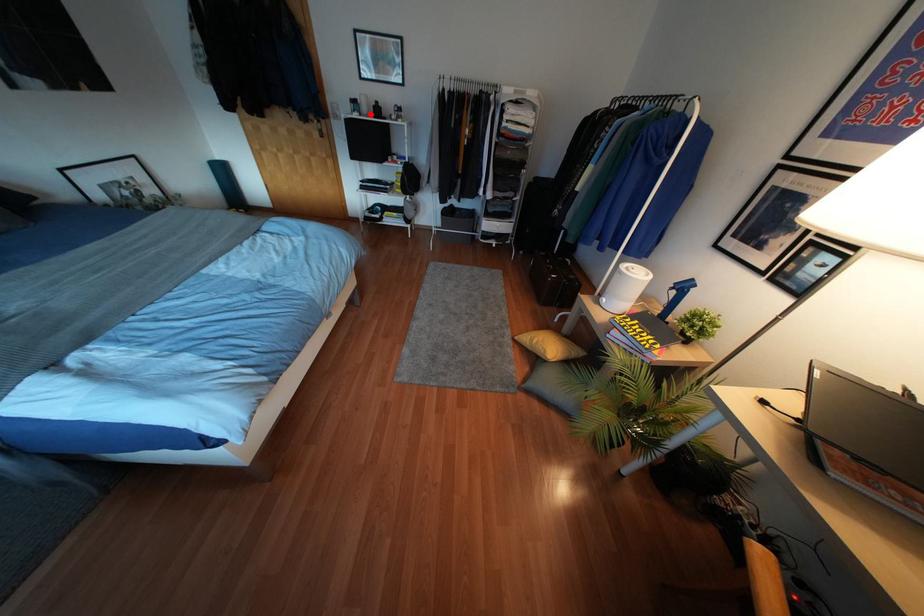
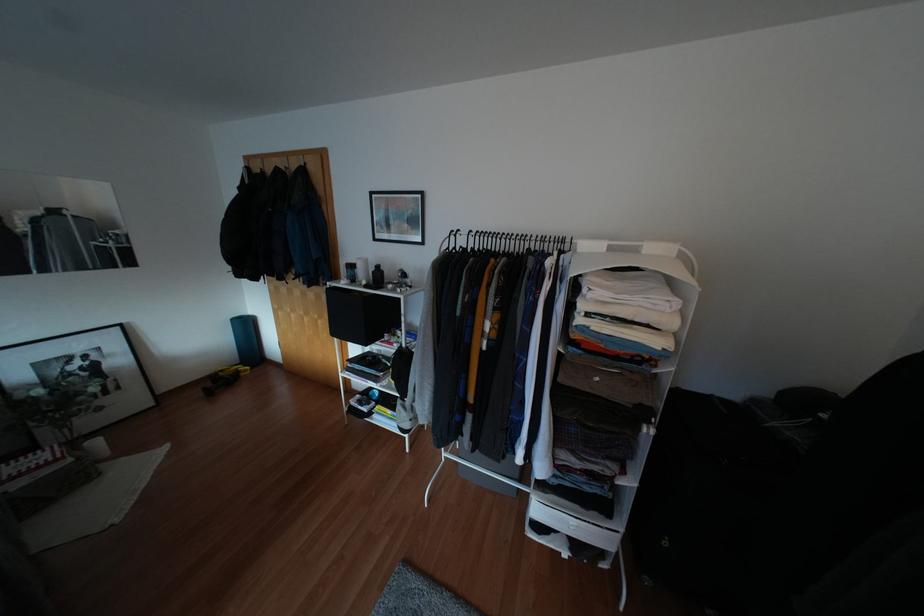
Question: I am providing you with two images of the same scene from different viewpoints. Given a red point in image1, look at the same physical point in image2. Is it:

Choices:
 (A) Closer to the viewpoint
 (B) Farther from the viewpoint

Answer: (B)